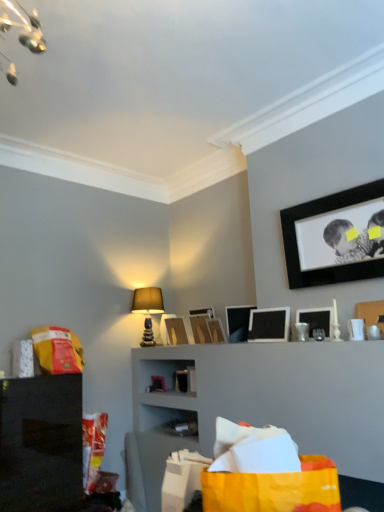
Identify the location of orange plastic bag at lower right, which is counted as the third shopping bag, starting from the back. Image resolution: width=384 pixels, height=512 pixels. (266, 473).

This screenshot has width=384, height=512. I want to click on matte black picture frame at upper right, the 2th picture frame viewed from the front, so click(x=317, y=319).

What is the approximate height of matte cardboard picture frame at center, placed as the seventh picture frame when sorted from front to back?

matte cardboard picture frame at center, placed as the seventh picture frame when sorted from front to back, is 10.86 inches in height.

Image resolution: width=384 pixels, height=512 pixels. I want to click on matte black picture frame at upper right, which ranks as the 6th picture frame in back-to-front order, so click(269, 325).

How much space does matte black picture frame at upper right, which ranks as the 6th picture frame in back-to-front order, occupy vertically?

matte black picture frame at upper right, which ranks as the 6th picture frame in back-to-front order, is 29.36 centimeters tall.

Measure the distance between point (x=226, y=316) and camera.

Point (x=226, y=316) is 3.67 meters away from camera.

The height and width of the screenshot is (512, 384). What do you see at coordinates (40, 442) in the screenshot?
I see `black glossy cabinet at lower left` at bounding box center [40, 442].

Measure the distance between black matte picture frame at upper right, which is counted as the first picture frame, starting from the front, and camera.

black matte picture frame at upper right, which is counted as the first picture frame, starting from the front, and camera are 2.61 meters apart from each other.

The height and width of the screenshot is (512, 384). I want to click on orange plastic bag at lower right, which appears as the third shopping bag when viewed from the left, so click(266, 473).

Image resolution: width=384 pixels, height=512 pixels. In order to click on shopping bag to the left of satin beige lampshade at upper center in this screenshot , I will do `click(58, 350)`.

Between orange plastic bag at left, which ranks as the third shopping bag in right-to-left order, and satin beige lampshade at upper center, which one has smaller width?

Thinner between the two is orange plastic bag at left, which ranks as the third shopping bag in right-to-left order.

Would you say orange plastic bag at left, which ranks as the third shopping bag in right-to-left order, is inside or outside satin beige lampshade at upper center?

orange plastic bag at left, which ranks as the third shopping bag in right-to-left order, cannot be found inside satin beige lampshade at upper center.

From the image's perspective, which is below, orange plastic bag at left, which appears as the third shopping bag when viewed from the front, or satin beige lampshade at upper center?

orange plastic bag at left, which appears as the third shopping bag when viewed from the front, appears lower in the image.

From a real-world perspective, is matte black picture frame at upper right, which is the 3th picture frame from front to back, on matte cardboard picture frame at center, which ranks as the second picture frame in back-to-front order?

No, from a real-world perspective, matte black picture frame at upper right, which is the 3th picture frame from front to back, is not above matte cardboard picture frame at center, which ranks as the second picture frame in back-to-front order.

Which is closer, (274,338) or (167,330)?

The point (274,338) is closer.

Is matte black picture frame at upper right, which ranks as the 6th picture frame in back-to-front order, thinner than matte cardboard picture frame at center, which ranks as the second picture frame in back-to-front order?

Correct, the width of matte black picture frame at upper right, which ranks as the 6th picture frame in back-to-front order, is less than that of matte cardboard picture frame at center, which ranks as the second picture frame in back-to-front order.

Locate an element on the screen. This screenshot has width=384, height=512. the 4th picture frame in front when counting from the matte cardboard picture frame at center, placed as the seventh picture frame when sorted from front to back is located at coordinates (269, 325).

Is matte cardboard picture frame at center, placed as the seventh picture frame when sorted from front to back, far from matte black picture frame at upper right, the seventh picture frame when ordered from back to front?

Yes, matte cardboard picture frame at center, placed as the seventh picture frame when sorted from front to back, is far from matte black picture frame at upper right, the seventh picture frame when ordered from back to front.

From a real-world perspective, does matte cardboard picture frame at center, which ranks as the second picture frame in back-to-front order, stand above matte black picture frame at upper right, the seventh picture frame when ordered from back to front?

Correct, in the physical world, matte cardboard picture frame at center, which ranks as the second picture frame in back-to-front order, is higher than matte black picture frame at upper right, the seventh picture frame when ordered from back to front.

Which of these two, matte cardboard picture frame at center, which ranks as the second picture frame in back-to-front order, or matte black picture frame at upper right, the 2th picture frame viewed from the front, stands taller?

matte cardboard picture frame at center, which ranks as the second picture frame in back-to-front order, is taller.

Based on the photo, is matte cardboard picture frame at center, placed as the seventh picture frame when sorted from front to back, outside of matte black picture frame at upper right, the 2th picture frame viewed from the front?

matte cardboard picture frame at center, placed as the seventh picture frame when sorted from front to back, is positioned outside matte black picture frame at upper right, the 2th picture frame viewed from the front.

Is orange plastic bag at lower right, which appears as the third shopping bag when viewed from the left, taller than black matte picture frame at upper right, which is counted as the first picture frame, starting from the front?

No.

Is orange plastic bag at lower right, marked as the 1th shopping bag in a front-to-back arrangement, positioned with its back to black matte picture frame at upper right, which appears as the eighth picture frame when viewed from the back?

No, black matte picture frame at upper right, which appears as the eighth picture frame when viewed from the back, is not at the back of orange plastic bag at lower right, marked as the 1th shopping bag in a front-to-back arrangement.

Which object is positioned more to the left, orange plastic bag at lower right, which is counted as the third shopping bag, starting from the back, or black matte picture frame at upper right, which appears as the eighth picture frame when viewed from the back?

From the viewer's perspective, orange plastic bag at lower right, which is counted as the third shopping bag, starting from the back, appears more on the left side.

Which of these two, orange plastic bag at lower right, which is counted as the third shopping bag, starting from the back, or black matte picture frame at upper right, which is counted as the first picture frame, starting from the front, is wider?

orange plastic bag at lower right, which is counted as the third shopping bag, starting from the back, is wider.

From the image's perspective, between satin beige lampshade at upper center and matte black picture frame at upper center, the fourth picture frame positioned from the back, which one is located above?

From the image's view, matte black picture frame at upper center, the fourth picture frame positioned from the back, is above.

Would you consider satin beige lampshade at upper center to be distant from matte black picture frame at upper center, which is the 5th picture frame from front to back?

No, satin beige lampshade at upper center is not far away from matte black picture frame at upper center, which is the 5th picture frame from front to back.

Where is `the 1st picture frame above the satin beige lampshade at upper center (from the image's perspective)`? This screenshot has width=384, height=512. the 1st picture frame above the satin beige lampshade at upper center (from the image's perspective) is located at coordinates (238, 322).

From the picture: Is satin beige lampshade at upper center to the right of matte black picture frame at upper center, the fourth picture frame positioned from the back, from the viewer's perspective?

Incorrect, satin beige lampshade at upper center is not on the right side of matte black picture frame at upper center, the fourth picture frame positioned from the back.

From the image's perspective, between yellow paper shopping bag at lower center, which appears as the 2th shopping bag when viewed from the left, and wooden picture frame at center, acting as the fifth picture frame starting from the back, who is located below?

From the image's view, yellow paper shopping bag at lower center, which appears as the 2th shopping bag when viewed from the left, is below.

Considering the sizes of objects yellow paper shopping bag at lower center, the second shopping bag from the front, and wooden picture frame at center, acting as the fifth picture frame starting from the back, in the image provided, who is taller, yellow paper shopping bag at lower center, the second shopping bag from the front, or wooden picture frame at center, acting as the fifth picture frame starting from the back,?

With more height is yellow paper shopping bag at lower center, the second shopping bag from the front.

Which of these two, yellow paper shopping bag at lower center, which appears as the 2th shopping bag when viewed from the left, or wooden picture frame at center, acting as the fifth picture frame starting from the back, is bigger?

yellow paper shopping bag at lower center, which appears as the 2th shopping bag when viewed from the left.

Considering the points (166, 472) and (210, 328), which point is in front, point (166, 472) or point (210, 328)?

Positioned in front is point (166, 472).

From the image's perspective, which is above, orange plastic bag at left, placed as the 1th shopping bag when sorted from left to right, or orange plastic bag at lower right, which is counted as the third shopping bag, starting from the back?

orange plastic bag at lower right, which is counted as the third shopping bag, starting from the back, appears higher in the image.

Considering the positions of objects orange plastic bag at left, placed as the 1th shopping bag when sorted from left to right, and orange plastic bag at lower right, which appears as the third shopping bag when viewed from the left, in the image provided, who is more to the right, orange plastic bag at left, placed as the 1th shopping bag when sorted from left to right, or orange plastic bag at lower right, which appears as the third shopping bag when viewed from the left,?

Positioned to the right is orange plastic bag at lower right, which appears as the third shopping bag when viewed from the left.

Who is more distant, orange plastic bag at left, placed as the 1th shopping bag when sorted from left to right, or orange plastic bag at lower right, which is the 1th shopping bag in right-to-left order?

orange plastic bag at left, placed as the 1th shopping bag when sorted from left to right, is further away from the camera.

Can you confirm if orange plastic bag at left, which appears as the third shopping bag when viewed from the front, is wider than orange plastic bag at lower right, marked as the 1th shopping bag in a front-to-back arrangement?

No.

Where is `table lamp that appears on the right of orange plastic bag at left, which ranks as the third shopping bag in right-to-left order`? This screenshot has height=512, width=384. table lamp that appears on the right of orange plastic bag at left, which ranks as the third shopping bag in right-to-left order is located at coordinates coord(148,310).

Locate an element on the screen. picture frame that is the 1st one below the matte cardboard picture frame at center, placed as the seventh picture frame when sorted from front to back (from a real-world perspective) is located at coordinates (269, 325).

When comparing their distances from satin beige lampshade at upper center, does matte black picture frame at upper center, which appears as the eighth picture frame when viewed from the front, or matte black picture frame at upper right, the seventh picture frame when ordered from back to front, seem further?

matte black picture frame at upper right, the seventh picture frame when ordered from back to front, is further to satin beige lampshade at upper center.

Estimate the real-world distances between objects in this image. Which object is further from wooden picture frame at center, arranged as the fourth picture frame when viewed from the front, matte black picture frame at upper center, the fourth picture frame positioned from the back, or matte black picture frame at upper right, which ranks as the 6th picture frame in back-to-front order?

matte black picture frame at upper right, which ranks as the 6th picture frame in back-to-front order, is further to wooden picture frame at center, arranged as the fourth picture frame when viewed from the front.

Estimate the real-world distances between objects in this image. Which object is further from yellow paper shopping bag at lower center, which ranks as the 2th shopping bag in back-to-front order, wooden picture frame at center, the 3th picture frame positioned from the back, or matte black picture frame at upper center, the fourth picture frame positioned from the back?

The object further to yellow paper shopping bag at lower center, which ranks as the 2th shopping bag in back-to-front order, is wooden picture frame at center, the 3th picture frame positioned from the back.

Looking at the image, which one is located further to yellow paper shopping bag at lower center, which ranks as the 2th shopping bag in back-to-front order, black matte picture frame at upper right, which is counted as the first picture frame, starting from the front, or matte black picture frame at upper center, which appears as the eighth picture frame when viewed from the front?

matte black picture frame at upper center, which appears as the eighth picture frame when viewed from the front, lies further to yellow paper shopping bag at lower center, which ranks as the 2th shopping bag in back-to-front order, than the other object.

Based on their spatial positions, is matte black picture frame at upper right, which ranks as the 6th picture frame in back-to-front order, or matte cardboard picture frame at center, which ranks as the second picture frame in back-to-front order, closer to matte black picture frame at upper center, which is the 5th picture frame from front to back?

matte black picture frame at upper right, which ranks as the 6th picture frame in back-to-front order, is closer to matte black picture frame at upper center, which is the 5th picture frame from front to back.

When comparing their distances from matte black picture frame at upper center, the fourth picture frame positioned from the back, does black glossy cabinet at lower left or matte cardboard picture frame at center, which ranks as the second picture frame in back-to-front order, seem closer?

Among the two, matte cardboard picture frame at center, which ranks as the second picture frame in back-to-front order, is located nearer to matte black picture frame at upper center, the fourth picture frame positioned from the back.

Considering their positions, is matte black picture frame at upper center, which appears as the eighth picture frame when viewed from the front, positioned further to matte black picture frame at upper center, which is the 5th picture frame from front to back, than yellow paper shopping bag at lower center, which appears as the 2th shopping bag when viewed from the left?

yellow paper shopping bag at lower center, which appears as the 2th shopping bag when viewed from the left, is positioned further to the anchor matte black picture frame at upper center, which is the 5th picture frame from front to back.

When comparing their distances from black matte picture frame at upper right, which appears as the eighth picture frame when viewed from the back, does matte black picture frame at upper right, the seventh picture frame when ordered from back to front, or satin beige lampshade at upper center seem further?

The object further to black matte picture frame at upper right, which appears as the eighth picture frame when viewed from the back, is satin beige lampshade at upper center.

You are a GUI agent. You are given a task and a screenshot of the screen. Output one action in this format:
    pyautogui.click(x=<x>, y=<y>)
    Task: Click on the table lamp between black glossy cabinet at lower left and black matte picture frame at upper right, which is counted as the first picture frame, starting from the front, from left to right
    The height and width of the screenshot is (512, 384).
    Given the screenshot: What is the action you would take?
    pyautogui.click(x=148, y=310)

This screenshot has height=512, width=384. Find the location of `picture frame located between black glossy cabinet at lower left and wooden picture frame at center, positioned as the 6th picture frame in front-to-back order, in the left-right direction`. picture frame located between black glossy cabinet at lower left and wooden picture frame at center, positioned as the 6th picture frame in front-to-back order, in the left-right direction is located at coordinates pos(176,331).

Where is `shopping bag between orange plastic bag at lower right, marked as the 1th shopping bag in a front-to-back arrangement, and black glossy cabinet at lower left, along the z-axis`? The image size is (384, 512). shopping bag between orange plastic bag at lower right, marked as the 1th shopping bag in a front-to-back arrangement, and black glossy cabinet at lower left, along the z-axis is located at coordinates (182, 479).

This screenshot has width=384, height=512. In order to click on table lamp located between orange plastic bag at lower right, which appears as the third shopping bag when viewed from the left, and matte black picture frame at upper center, which is the 1th picture frame in back-to-front order, in the depth direction in this screenshot , I will do `click(148, 310)`.